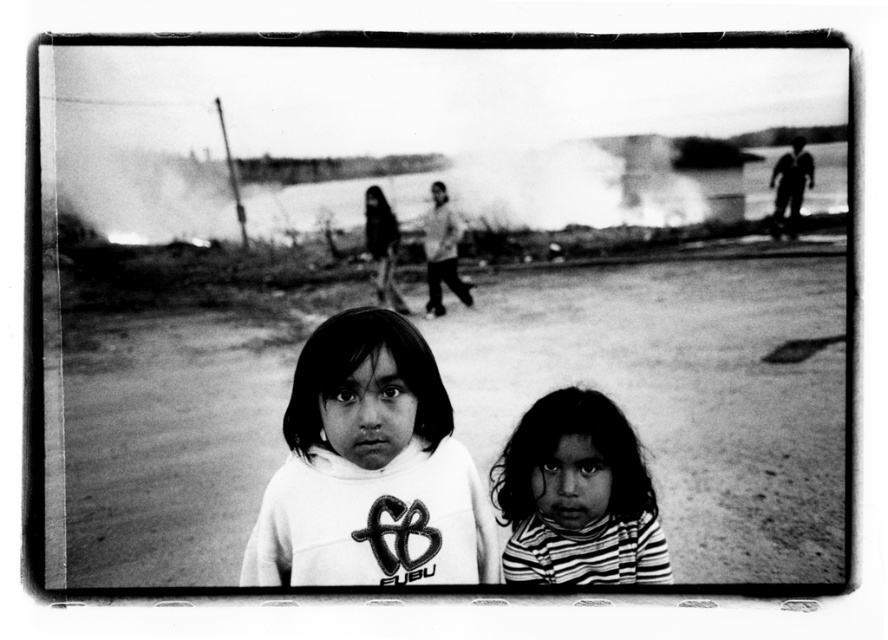
Question: Can you confirm if white soft sweatshirt at center is wider than striped fabric shirt at lower right?

Choices:
 (A) yes
 (B) no

Answer: (A)

Question: Among these objects, which one is nearest to the camera?

Choices:
 (A) white soft sweatshirt at center
 (B) striped fabric shirt at lower right

Answer: (A)

Question: Which point is closer to the camera?

Choices:
 (A) striped fabric shirt at lower right
 (B) white soft sweatshirt at center

Answer: (B)

Question: Is the position of white soft sweatshirt at center less distant than that of striped fabric shirt at lower right?

Choices:
 (A) no
 (B) yes

Answer: (B)

Question: Is white soft sweatshirt at center behind striped fabric shirt at lower right?

Choices:
 (A) yes
 (B) no

Answer: (B)